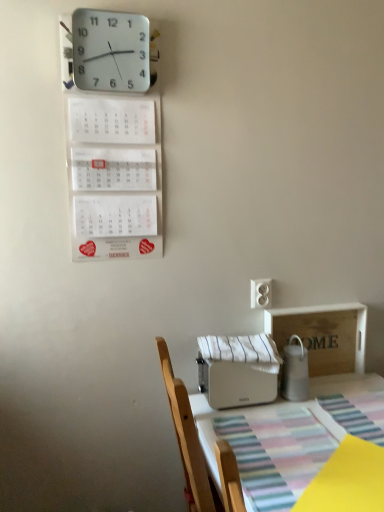
You are a GUI agent. You are given a task and a screenshot of the screen. Output one action in this format:
    pyautogui.click(x=<x>, y=<y>)
    Task: Click on the vacant region in front of white glossy milk jug at right, acting as the 1th appliance starting from the right
    This screenshot has width=384, height=512.
    Given the screenshot: What is the action you would take?
    pyautogui.click(x=307, y=421)